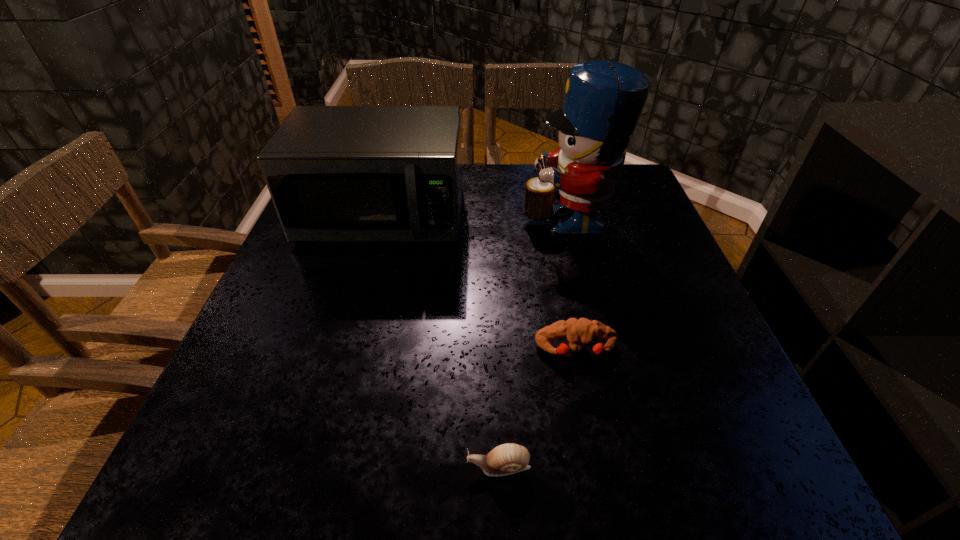
You are a GUI agent. You are given a task and a screenshot of the screen. Output one action in this format:
    pyautogui.click(x=<x>, y=<y>)
    Task: Click on the blank area in the image that satisfies the following two spatial constraints: 1. on the front-facing side of the tallest object; 2. on the front-facing side of the third shortest object
    Image resolution: width=960 pixels, height=540 pixels.
    Given the screenshot: What is the action you would take?
    pyautogui.click(x=566, y=217)

The image size is (960, 540). Find the location of `vacant space that satisfies the following two spatial constraints: 1. on the front-facing side of the nutcracker; 2. with the gloves of the puncher facing forward`. vacant space that satisfies the following two spatial constraints: 1. on the front-facing side of the nutcracker; 2. with the gloves of the puncher facing forward is located at coordinates (600, 349).

You are a GUI agent. You are given a task and a screenshot of the screen. Output one action in this format:
    pyautogui.click(x=<x>, y=<y>)
    Task: Click on the vacant space that satisfies the following two spatial constraints: 1. on the front-facing side of the nutcracker; 2. with the gloves of the puncher facing forward
    The height and width of the screenshot is (540, 960).
    Given the screenshot: What is the action you would take?
    pyautogui.click(x=600, y=349)

In order to click on vacant position in the image that satisfies the following two spatial constraints: 1. on the front-facing side of the nutcracker; 2. with the gloves of the puncher facing forward in this screenshot , I will do `click(600, 349)`.